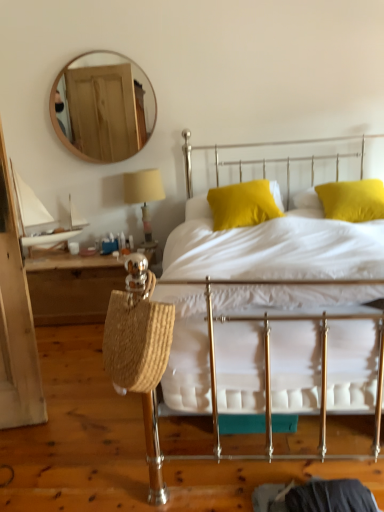
Question: Is wooden round mirror at upper left far away from yellow fabric pillow at center, which is counted as the 2th pillow, starting from the right?

Choices:
 (A) no
 (B) yes

Answer: (B)

Question: Considering the relative positions of wooden round mirror at upper left and yellow fabric pillow at center, which is counted as the 2th pillow, starting from the right, in the image provided, is wooden round mirror at upper left to the left of yellow fabric pillow at center, which is counted as the 2th pillow, starting from the right, from the viewer's perspective?

Choices:
 (A) yes
 (B) no

Answer: (A)

Question: From a real-world perspective, is wooden round mirror at upper left under yellow fabric pillow at center, which is counted as the 2th pillow, starting from the right?

Choices:
 (A) yes
 (B) no

Answer: (B)

Question: From the image's perspective, is wooden round mirror at upper left beneath yellow fabric pillow at center, which appears as the first pillow when viewed from the left?

Choices:
 (A) yes
 (B) no

Answer: (B)

Question: Is wooden round mirror at upper left beside yellow fabric pillow at center, which appears as the first pillow when viewed from the left?

Choices:
 (A) yes
 (B) no

Answer: (B)

Question: Can you confirm if wooden round mirror at upper left is thinner than yellow fabric pillow at center, which appears as the first pillow when viewed from the left?

Choices:
 (A) no
 (B) yes

Answer: (B)

Question: Could you tell me if wooden round mirror at upper left is turned towards woven straw bag at left?

Choices:
 (A) yes
 (B) no

Answer: (B)

Question: From the image's perspective, is wooden round mirror at upper left on woven straw bag at left?

Choices:
 (A) yes
 (B) no

Answer: (A)

Question: Does wooden round mirror at upper left contain woven straw bag at left?

Choices:
 (A) no
 (B) yes

Answer: (A)

Question: Are wooden round mirror at upper left and woven straw bag at left located far from each other?

Choices:
 (A) no
 (B) yes

Answer: (B)

Question: Considering the relative sizes of wooden round mirror at upper left and woven straw bag at left in the image provided, is wooden round mirror at upper left smaller than woven straw bag at left?

Choices:
 (A) yes
 (B) no

Answer: (A)

Question: From a real-world perspective, is wooden round mirror at upper left physically above woven straw bag at left?

Choices:
 (A) yes
 (B) no

Answer: (A)

Question: Considering the relative sizes of yellow fabric pillow at center, which is counted as the 2th pillow, starting from the right, and woven straw bag at left in the image provided, is yellow fabric pillow at center, which is counted as the 2th pillow, starting from the right, taller than woven straw bag at left?

Choices:
 (A) no
 (B) yes

Answer: (A)